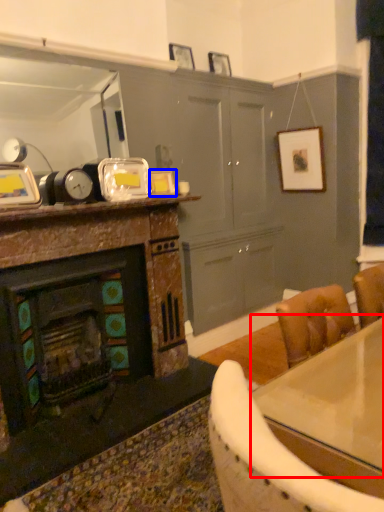
Question: Among these objects, which one is nearest to the camera, counter top (highlighted by a red box) or picture frame (highlighted by a blue box)?

Choices:
 (A) counter top
 (B) picture frame

Answer: (A)